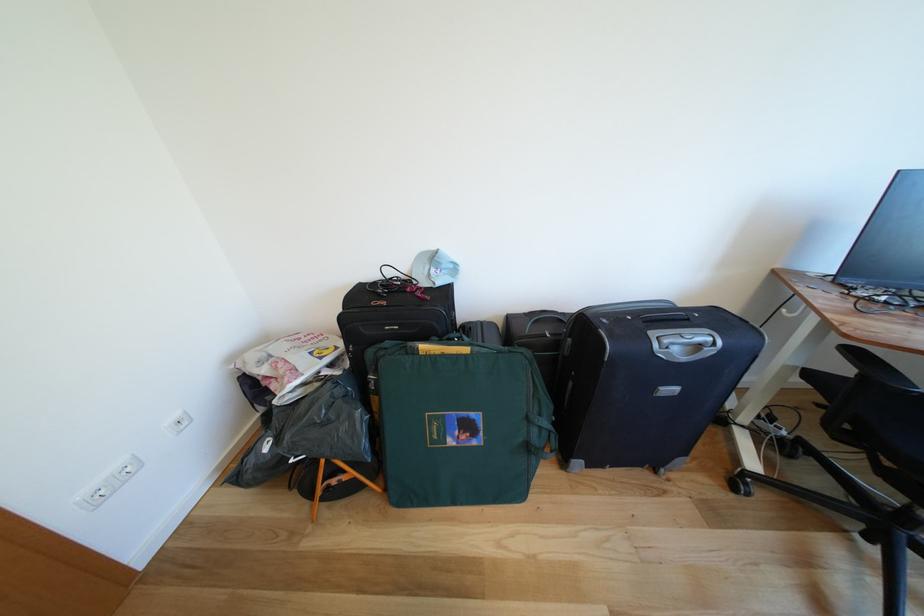
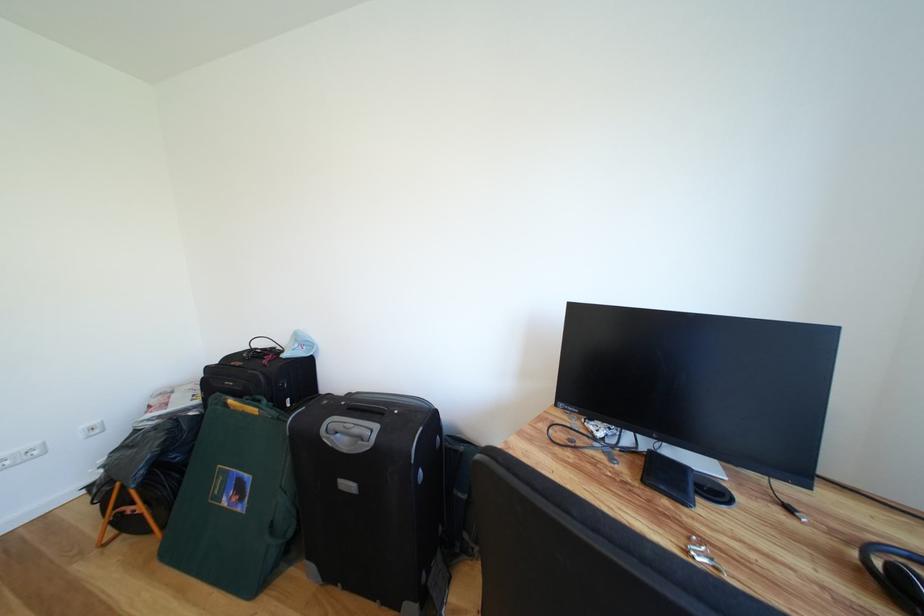
Locate, in the second image, the point that corresponds to [442,275] in the first image.

(305, 350)